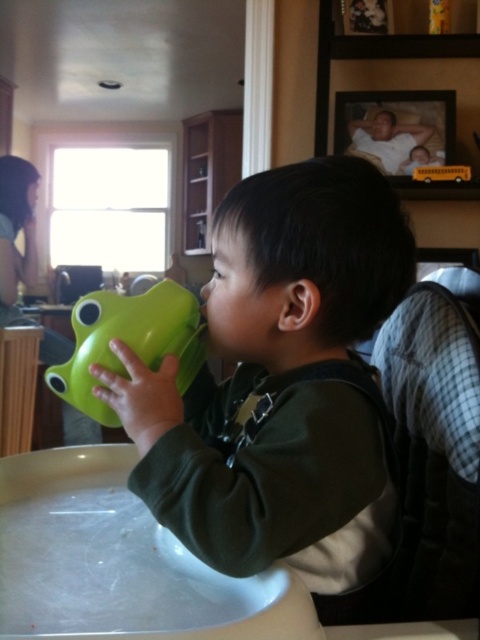
Based on the photo, which is more to the left, green rubber cup at center or green rubber duck at center?

From the viewer's perspective, green rubber duck at center appears more on the left side.

Is green rubber cup at center wider than green rubber duck at center?

Correct, the width of green rubber cup at center exceeds that of green rubber duck at center.

Between point (171, 442) and point (156, 300), which one is positioned behind?

The point (156, 300) is more distant.

The image size is (480, 640). What are the coordinates of `green rubber cup at center` in the screenshot? It's located at (283, 387).